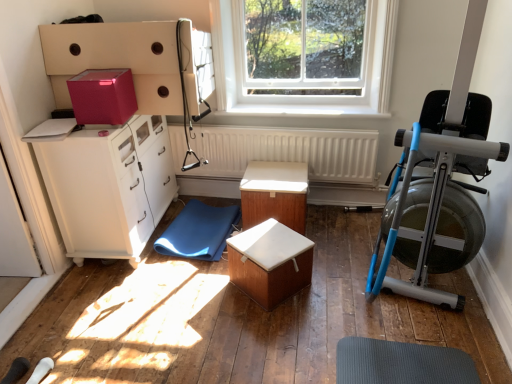
Find the location of a particular element. This screenshot has height=384, width=512. vacant space situated on the left part of wooden box at center, marked as the second table in a back-to-front arrangement is located at coordinates (206, 297).